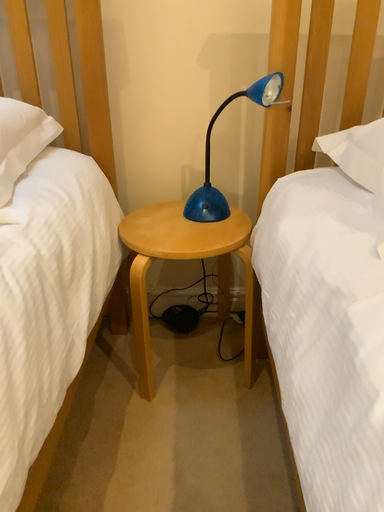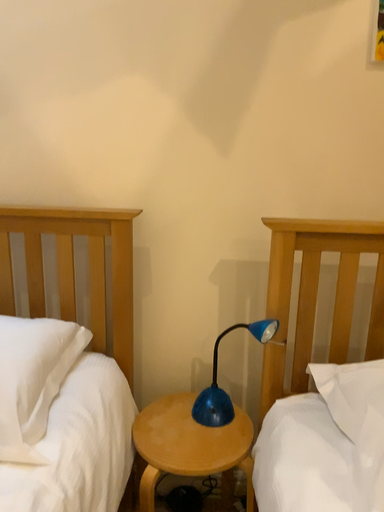
Question: How did the camera likely rotate when shooting the video?

Choices:
 (A) rotated upward
 (B) rotated downward

Answer: (A)